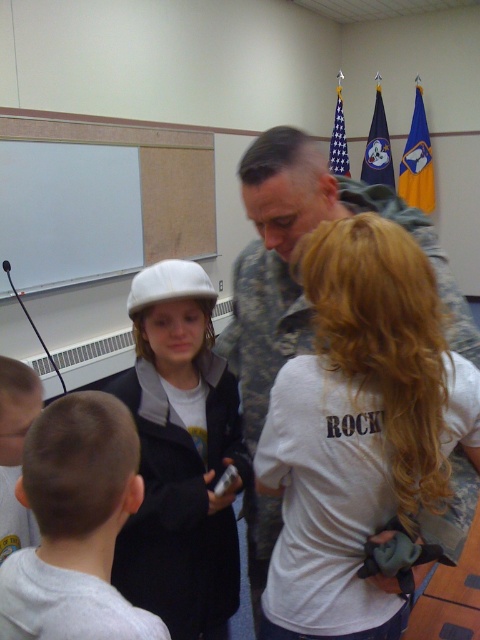
Can you confirm if light brown hair at lower left is positioned to the left of white matte uniform at lower left?

In fact, light brown hair at lower left is to the right of white matte uniform at lower left.

Can you confirm if light brown hair at lower left is positioned below white matte uniform at lower left?

Actually, light brown hair at lower left is above white matte uniform at lower left.

Which is in front, point (100, 593) or point (33, 560)?

Positioned in front is point (100, 593).

What are the coordinates of `light brown hair at lower left` in the screenshot? It's located at (75, 525).

Is point (188, 589) in front of point (72, 596)?

That is False.

Between point (186, 292) and point (131, 620), which one is positioned in front?

Point (131, 620) is in front.

At what (x,y) coordinates should I click in order to perform the action: click on white matte helmet at upper left. Please return your answer as a coordinate pair (x, y). Looking at the image, I should click on (180, 458).

Who is positioned more to the left, white matte t-shirt at center or light brown hair at lower left?

light brown hair at lower left is more to the left.

Does point (361, 497) lie in front of point (111, 492)?

That is False.

Where is `white matte t-shirt at center`? Image resolution: width=480 pixels, height=640 pixels. white matte t-shirt at center is located at coordinates (324, 499).